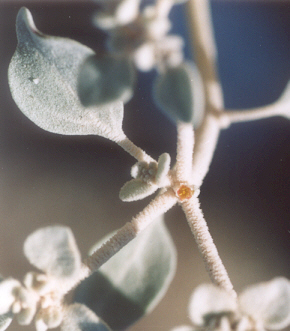
Identify the location of green plant leaf. The width and height of the screenshot is (290, 331). (127, 266), (62, 253), (69, 312), (269, 304), (212, 301), (68, 75), (109, 76), (174, 84), (287, 94).